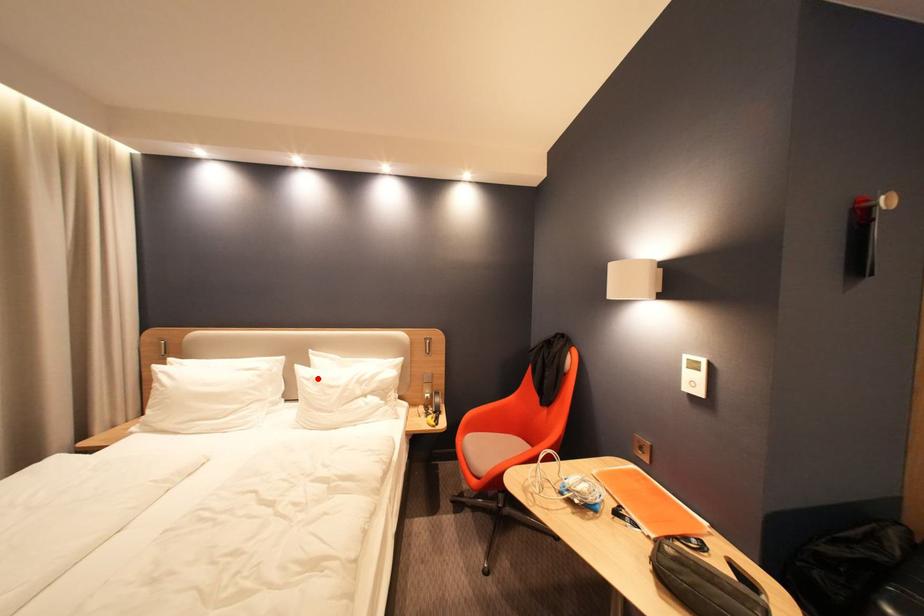
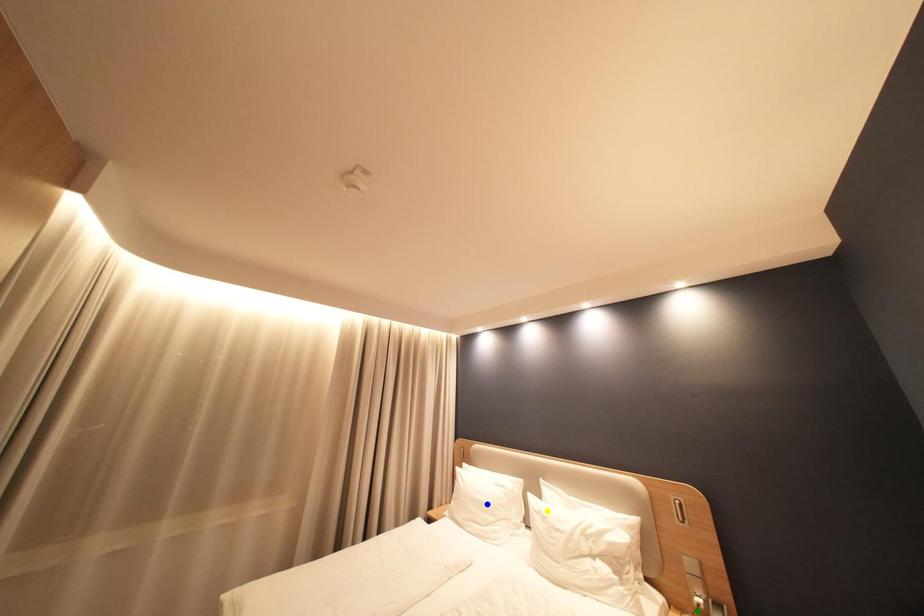
Question: I am providing you with two images of the same scene from different viewpoints. A red point is marked on the first image. You are given multiple points on the second image. Which point in image 2 is actually the same real-world point as the red point in image 1?

Choices:
 (A) yellow point
 (B) blue point
 (C) green point

Answer: (A)